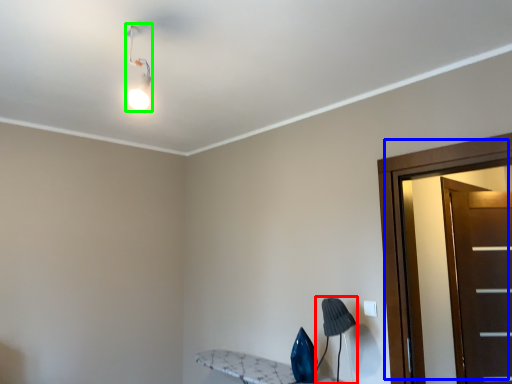
Question: Estimate the real-world distances between objects in this image. Which object is farther from table lamp (highlighted by a red box), door (highlighted by a blue box) or light fixture (highlighted by a green box)?

Choices:
 (A) door
 (B) light fixture

Answer: (B)